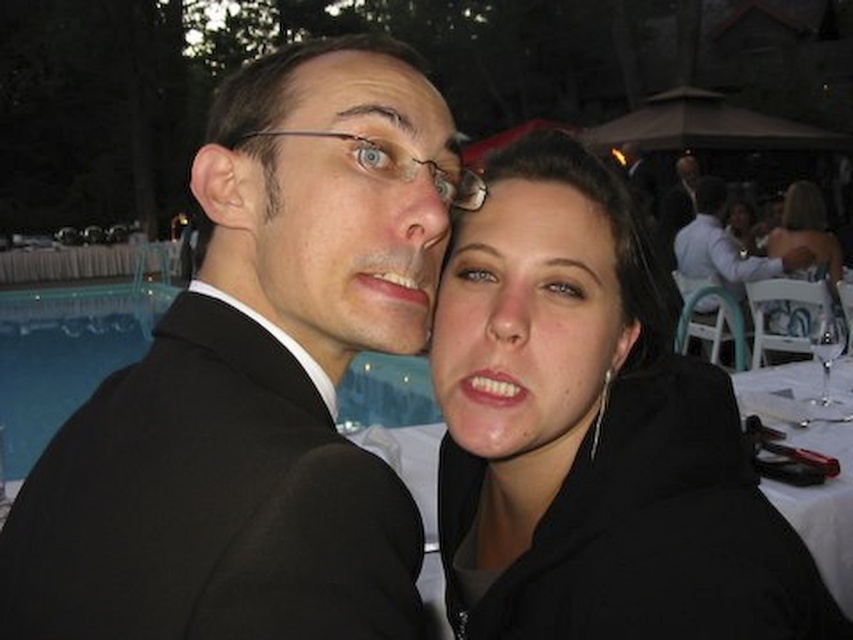
Question: Which of the following is the farthest from the observer?

Choices:
 (A) coord(39,385)
 (B) coord(692,172)

Answer: (B)

Question: Can you confirm if blue glass pool at lower left is thinner than transparent glass wine glass at right?

Choices:
 (A) yes
 (B) no

Answer: (A)

Question: Which point is farther to the camera?

Choices:
 (A) (662, 214)
 (B) (834, 236)
 (C) (840, 426)

Answer: (A)

Question: Which of the following is the closest to the observer?

Choices:
 (A) black suit at center
 (B) smooth skin face at upper right
 (C) transparent glass wine glass at right

Answer: (A)

Question: Where is matte black glasses at upper center located in relation to matte black suit at center in the image?

Choices:
 (A) left
 (B) right

Answer: (A)

Question: Is black suit at center wider than transparent glass wine glass at right?

Choices:
 (A) no
 (B) yes

Answer: (A)